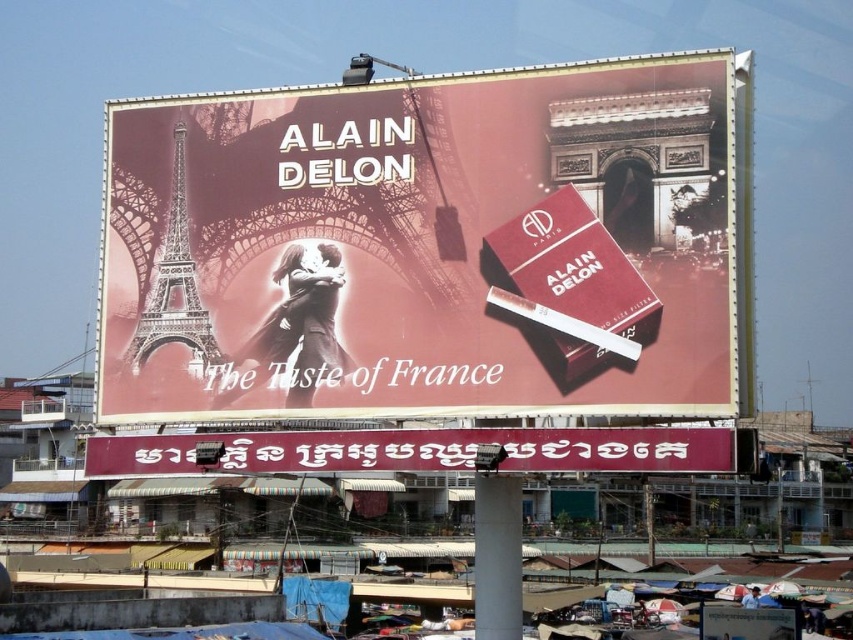
Question: Is maroon fabric banner at lower center above metallic silver eiffel tower at left?

Choices:
 (A) no
 (B) yes

Answer: (A)

Question: Does matte red cigarette pack at center have a greater width compared to metallic silver eiffel tower at left?

Choices:
 (A) yes
 (B) no

Answer: (A)

Question: Is matte red cigarette pack at center to the right of maroon fabric banner at lower center from the viewer's perspective?

Choices:
 (A) no
 (B) yes

Answer: (B)

Question: Among these points, which one is nearest to the camera?

Choices:
 (A) (154, 337)
 (B) (196, 470)
 (C) (711, 141)

Answer: (C)

Question: Which is farther from the maroon fabric banner at lower center?

Choices:
 (A) metallic silver eiffel tower at left
 (B) matte red cigarette pack at center

Answer: (A)

Question: Which object appears farthest from the camera in this image?

Choices:
 (A) maroon fabric banner at lower center
 (B) metallic silver eiffel tower at left
 (C) matte red cigarette pack at center

Answer: (B)